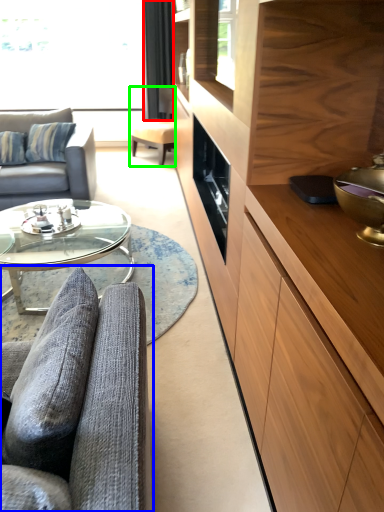
Question: Based on their relative distances, which object is farther from curtain (highlighted by a red box)? Choose from studio couch (highlighted by a blue box) and swivel chair (highlighted by a green box).

Choices:
 (A) studio couch
 (B) swivel chair

Answer: (A)